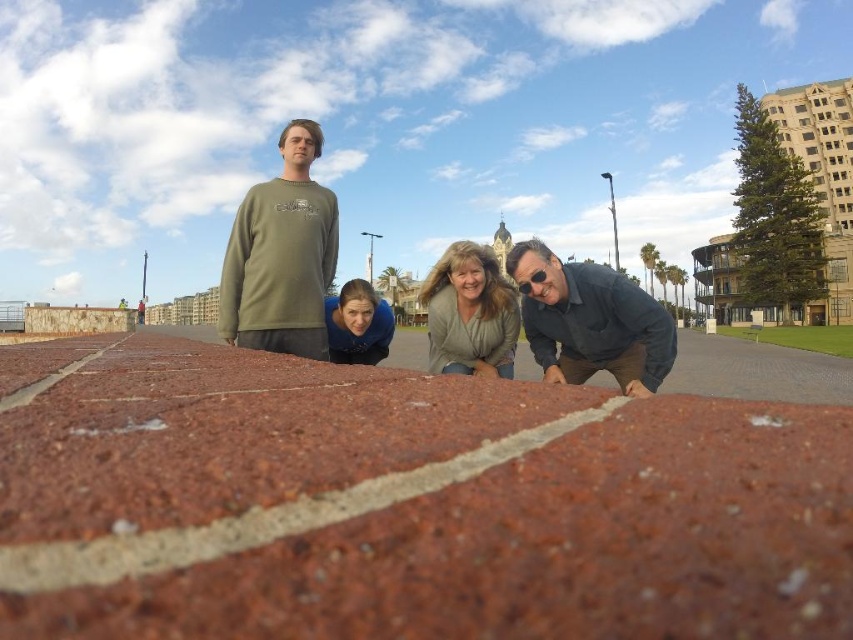
You are standing in the image and want to locate the dark gray shirt at lower right. What are the coordinates where you can find it?

The dark gray shirt at lower right can be found at coordinates point (590,321).

You are standing in the group photo scene and need to determine the order of two points based on their positions. Which point is closer to you, point (630,376) or point (811,358)?

Point (630,376) is in front of point (811,358), so it is closer to you.

You are a photographer trying to capture a photo of the group. You notice the green cotton shirt at center and the light brown sweater at center. Which one is more to the left in the image?

The green cotton shirt at center is positioned on the left side of the light brown sweater at center, so the green cotton shirt at center is more to the left.